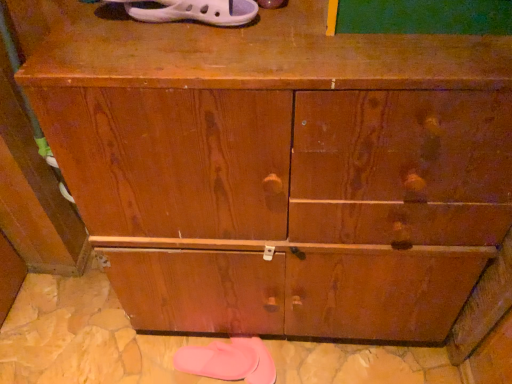
I want to click on vacant space positioned to the left of white rubber sandal at upper center, arranged as the 1th footwear when viewed from the top, so click(89, 39).